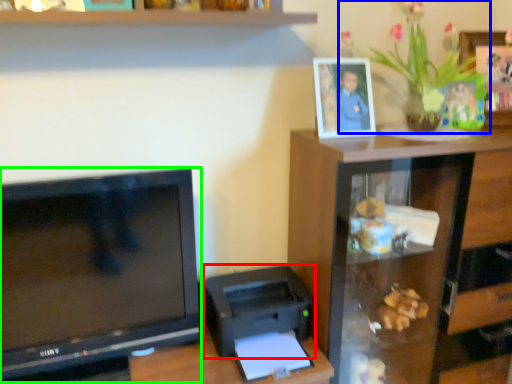
Question: Estimate the real-world distances between objects in this image. Which object is closer to printer (highlighted by a red box), houseplant (highlighted by a blue box) or television (highlighted by a green box)?

Choices:
 (A) houseplant
 (B) television

Answer: (B)